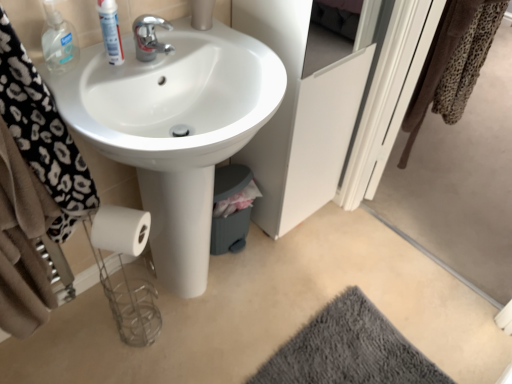
The image size is (512, 384). What do you see at coordinates (58, 41) in the screenshot?
I see `clear plastic bottle at upper left, positioned as the first mouthwash in left-to-right order` at bounding box center [58, 41].

This screenshot has height=384, width=512. Identify the location of clear plastic bottle at upper left, positioned as the first mouthwash in left-to-right order. (58, 41).

You are a GUI agent. You are given a task and a screenshot of the screen. Output one action in this format:
    pyautogui.click(x=<x>, y=<y>)
    Task: Click on the black leopard print towel at left
    This screenshot has height=384, width=512.
    Given the screenshot: What is the action you would take?
    pyautogui.click(x=42, y=134)

What do you see at coordinates (322, 135) in the screenshot?
I see `white matte cabinet at center, which is counted as the 1th screen door, starting from the left` at bounding box center [322, 135].

Locate an element on the screen. white glossy sink at center is located at coordinates (175, 128).

Identify the location of clear plastic bottle at upper left, the 2th mouthwash viewed from the right. (58, 41).

Considering the sizes of objects white glossy mouthwash at upper left, arranged as the 1th mouthwash when viewed from the right, and white glossy sink at center in the image provided, who is wider, white glossy mouthwash at upper left, arranged as the 1th mouthwash when viewed from the right, or white glossy sink at center?

Wider between the two is white glossy sink at center.

Who is taller, white glossy mouthwash at upper left, arranged as the 1th mouthwash when viewed from the right, or white glossy sink at center?

With more height is white glossy sink at center.

Looking at this image, is white glossy sink at center at the back of white glossy mouthwash at upper left, arranged as the 1th mouthwash when viewed from the right?

white glossy mouthwash at upper left, arranged as the 1th mouthwash when viewed from the right, does not have its back to white glossy sink at center.

Is white glossy mouthwash at upper left, arranged as the 1th mouthwash when viewed from the right, bigger than white glossy sink at center?

Actually, white glossy mouthwash at upper left, arranged as the 1th mouthwash when viewed from the right, might be smaller than white glossy sink at center.

Is gray fuzzy rug at lower right wider than white glossy sink at center?

Yes.

Is gray fuzzy rug at lower right to the left or to the right of white glossy sink at center in the image?

In the image, gray fuzzy rug at lower right appears on the right side of white glossy sink at center.

Is gray fuzzy rug at lower right with white glossy sink at center?

No, gray fuzzy rug at lower right is not in contact with white glossy sink at center.

Which is in front, gray fuzzy rug at lower right or white glossy sink at center?

Result: white glossy sink at center is more forward.

Is point (455, 4) positioned before point (63, 148)?

No.

Does leopard print towel at upper right contain black leopard print towel at left?

Actually, black leopard print towel at left is outside leopard print towel at upper right.

From a real-world perspective, who is located lower, leopard print towel at upper right or black leopard print towel at left?

leopard print towel at upper right.

Is the position of leopard print towel at upper right more distant than that of black leopard print towel at left?

Yes, leopard print towel at upper right is behind black leopard print towel at left.

Considering the sizes of objects transparent plastic screen door at upper right, arranged as the first screen door when viewed from the right, and black leopard print towel at left in the image provided, who is shorter, transparent plastic screen door at upper right, arranged as the first screen door when viewed from the right, or black leopard print towel at left?

Standing shorter between the two is black leopard print towel at left.

In terms of width, does transparent plastic screen door at upper right, arranged as the first screen door when viewed from the right, look wider or thinner when compared to black leopard print towel at left?

In the image, transparent plastic screen door at upper right, arranged as the first screen door when viewed from the right, appears to be more narrow than black leopard print towel at left.

Is transparent plastic screen door at upper right, arranged as the first screen door when viewed from the right, surrounding black leopard print towel at left?

No, black leopard print towel at left is located outside of transparent plastic screen door at upper right, arranged as the first screen door when viewed from the right.

Between transparent plastic screen door at upper right, arranged as the first screen door when viewed from the right, and black leopard print towel at left, which one appears on the right side from the viewer's perspective?

transparent plastic screen door at upper right, arranged as the first screen door when viewed from the right, is more to the right.

Is transparent plastic screen door at upper right, arranged as the first screen door when viewed from the right, taller or shorter than gray fuzzy rug at lower right?

Clearly, transparent plastic screen door at upper right, arranged as the first screen door when viewed from the right, is taller compared to gray fuzzy rug at lower right.

Which object is thinner, transparent plastic screen door at upper right, which is the 2th screen door in left-to-right order, or gray fuzzy rug at lower right?

Thinner between the two is transparent plastic screen door at upper right, which is the 2th screen door in left-to-right order.

In the scene shown: Would you say transparent plastic screen door at upper right, which is the 2th screen door in left-to-right order, is to the left or to the right of gray fuzzy rug at lower right in the picture?

Based on their positions, transparent plastic screen door at upper right, which is the 2th screen door in left-to-right order, is located to the right of gray fuzzy rug at lower right.

Which object is further away from the camera taking this photo, transparent plastic screen door at upper right, which is the 2th screen door in left-to-right order, or gray fuzzy rug at lower right?

gray fuzzy rug at lower right is further from the camera.

Considering the relative positions of leopard print towel at upper right and transparent plastic screen door at upper right, arranged as the first screen door when viewed from the right, in the image provided, is leopard print towel at upper right to the right of transparent plastic screen door at upper right, arranged as the first screen door when viewed from the right, from the viewer's perspective?

Correct, you'll find leopard print towel at upper right to the right of transparent plastic screen door at upper right, arranged as the first screen door when viewed from the right.

From the image's perspective, relative to transparent plastic screen door at upper right, which is the 2th screen door in left-to-right order, is leopard print towel at upper right above or below?

leopard print towel at upper right is above transparent plastic screen door at upper right, which is the 2th screen door in left-to-right order.

Is leopard print towel at upper right behind transparent plastic screen door at upper right, arranged as the first screen door when viewed from the right?

Yes, leopard print towel at upper right is behind transparent plastic screen door at upper right, arranged as the first screen door when viewed from the right.

From a real-world perspective, is leopard print towel at upper right beneath clear plastic bottle at upper left, the 2th mouthwash viewed from the right?

Yes.

Which mouthwash is the 2nd one when counting from the left side of the leopard print towel at upper right? Please provide its 2D coordinates.

[(58, 41)]

Considering the sizes of leopard print towel at upper right and clear plastic bottle at upper left, positioned as the first mouthwash in left-to-right order, in the image, is leopard print towel at upper right taller or shorter than clear plastic bottle at upper left, positioned as the first mouthwash in left-to-right order,?

Clearly, leopard print towel at upper right is taller compared to clear plastic bottle at upper left, positioned as the first mouthwash in left-to-right order.

Are leopard print towel at upper right and clear plastic bottle at upper left, the 2th mouthwash viewed from the right, located far from each other?

Indeed, leopard print towel at upper right is not near clear plastic bottle at upper left, the 2th mouthwash viewed from the right.

From a real-world perspective, which mouthwash is the 2nd one above the white glossy sink at center? Please provide its 2D coordinates.

[(110, 31)]

Where is `sink that appears on the left of gray fuzzy rug at lower right`? The height and width of the screenshot is (384, 512). sink that appears on the left of gray fuzzy rug at lower right is located at coordinates (175, 128).

From the image, which object appears to be nearer to gray fuzzy rug at lower right, transparent plastic screen door at upper right, which is the 2th screen door in left-to-right order, or white glossy sink at center?

white glossy sink at center is positioned closer to the anchor gray fuzzy rug at lower right.

Looking at the image, which one is located further to white glossy sink at center, white glossy mouthwash at upper left, which ranks as the second mouthwash in left-to-right order, or gray fuzzy rug at lower right?

Among the two, gray fuzzy rug at lower right is located further to white glossy sink at center.

Estimate the real-world distances between objects in this image. Which object is closer to leopard print towel at upper right, transparent plastic screen door at upper right, which is the 2th screen door in left-to-right order, or black leopard print towel at left?

The object closer to leopard print towel at upper right is transparent plastic screen door at upper right, which is the 2th screen door in left-to-right order.

Which object lies nearer to the anchor point white matte cabinet at center, which is the second screen door in right-to-left order, clear plastic bottle at upper left, positioned as the first mouthwash in left-to-right order, or transparent plastic screen door at upper right, which is the 2th screen door in left-to-right order?

transparent plastic screen door at upper right, which is the 2th screen door in left-to-right order.

When comparing their distances from leopard print towel at upper right, does white glossy mouthwash at upper left, which ranks as the second mouthwash in left-to-right order, or clear plastic bottle at upper left, the 2th mouthwash viewed from the right, seem closer?

white glossy mouthwash at upper left, which ranks as the second mouthwash in left-to-right order, is positioned closer to the anchor leopard print towel at upper right.

When comparing their distances from gray fuzzy rug at lower right, does black leopard print towel at left or clear plastic bottle at upper left, the 2th mouthwash viewed from the right, seem further?

Among the two, clear plastic bottle at upper left, the 2th mouthwash viewed from the right, is located further to gray fuzzy rug at lower right.

Based on their spatial positions, is white matte cabinet at center, which is counted as the 1th screen door, starting from the left, or chrome metallic faucet at upper center closer to black leopard print towel at left?

The object closer to black leopard print towel at left is chrome metallic faucet at upper center.

When comparing their distances from white glossy sink at center, does white matte cabinet at center, which is the second screen door in right-to-left order, or chrome metallic faucet at upper center seem closer?

Based on the image, chrome metallic faucet at upper center appears to be nearer to white glossy sink at center.

The height and width of the screenshot is (384, 512). I want to click on screen door situated between clear plastic bottle at upper left, the 2th mouthwash viewed from the right, and transparent plastic screen door at upper right, which is the 2th screen door in left-to-right order, from left to right, so click(322, 135).

Locate an element on the screen. screen door between black leopard print towel at left and gray fuzzy rug at lower right from left to right is located at coordinates (322, 135).

This screenshot has width=512, height=384. Find the location of `tap between black leopard print towel at left and transparent plastic screen door at upper right, which is the 2th screen door in left-to-right order`. tap between black leopard print towel at left and transparent plastic screen door at upper right, which is the 2th screen door in left-to-right order is located at coordinates (150, 37).

This screenshot has width=512, height=384. What are the coordinates of `mouthwash between clear plastic bottle at upper left, positioned as the first mouthwash in left-to-right order, and leopard print towel at upper right` in the screenshot? It's located at (110, 31).